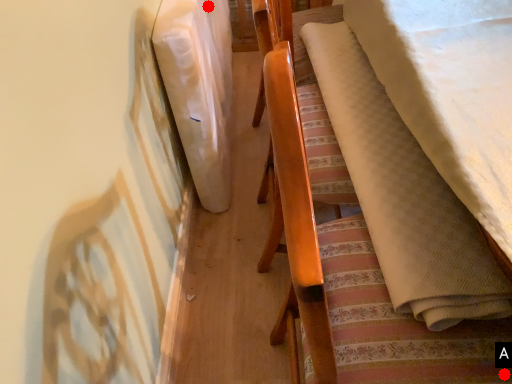
Question: Two points are circled on the image, labeled by A and B beside each circle. Which of the following is the farthest from the observer?

Choices:
 (A) A is further
 (B) B is further

Answer: (B)